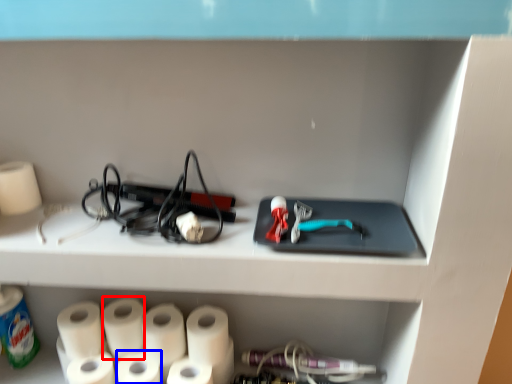
Question: Among these objects, which one is farthest to the camera, paper towel (highlighted by a red box) or paper towel (highlighted by a blue box)?

Choices:
 (A) paper towel
 (B) paper towel

Answer: (A)